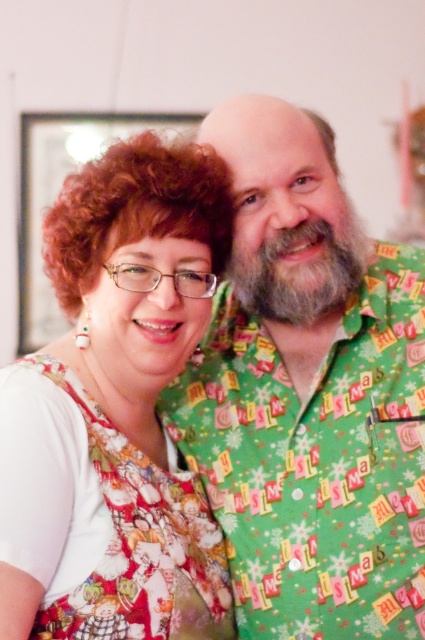
Question: Is the position of green fabric shirt at center less distant than that of matte floral dress at left?

Choices:
 (A) no
 (B) yes

Answer: (A)

Question: Among these points, which one is nearest to the camera?

Choices:
 (A) (36, 621)
 (B) (405, 289)
 (C) (300, 276)

Answer: (A)

Question: Which point is closer to the camera taking this photo?

Choices:
 (A) (337, 234)
 (B) (257, 305)
 (C) (76, 524)

Answer: (C)

Question: Is green fabric shirt at center smaller than white fluffy beard at center?

Choices:
 (A) no
 (B) yes

Answer: (A)

Question: From the image, what is the correct spatial relationship of green fabric shirt at center in relation to white fluffy beard at center?

Choices:
 (A) right
 (B) left

Answer: (B)

Question: Which of the following is the closest to the observer?

Choices:
 (A) matte floral dress at left
 (B) white fluffy beard at center

Answer: (A)